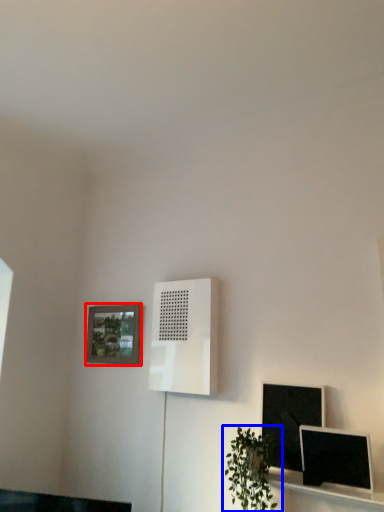
Question: Which of the following is the farthest to the observer, picture frame (highlighted by a red box) or houseplant (highlighted by a blue box)?

Choices:
 (A) picture frame
 (B) houseplant

Answer: (A)